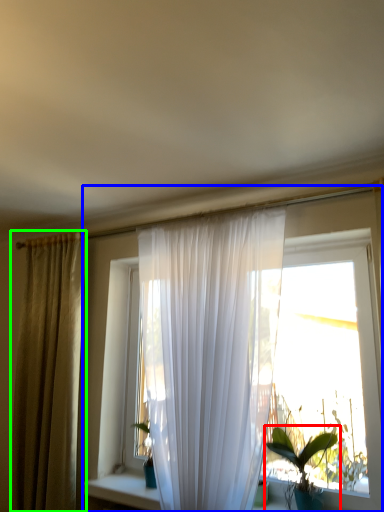
Question: Which is farther away from houseplant (highlighted by a red box)? window (highlighted by a blue box) or curtain (highlighted by a green box)?

Choices:
 (A) window
 (B) curtain

Answer: (B)